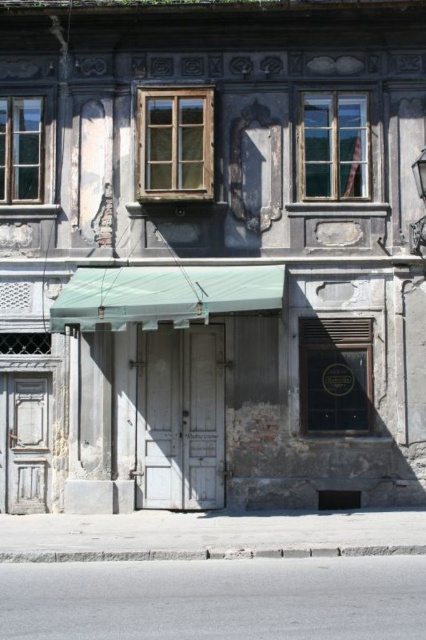
Question: Can you confirm if green fabric awning at center is positioned to the right of gray concrete curb at lower center?

Choices:
 (A) no
 (B) yes

Answer: (A)

Question: Is green fabric awning at center wider than gray concrete curb at lower center?

Choices:
 (A) yes
 (B) no

Answer: (B)

Question: Which point is closer to the camera taking this photo?

Choices:
 (A) (131, 321)
 (B) (106, 552)

Answer: (B)

Question: Can you confirm if green fabric awning at center is thinner than gray concrete curb at lower center?

Choices:
 (A) no
 (B) yes

Answer: (B)

Question: Which point is closer to the camera?

Choices:
 (A) (419, 550)
 (B) (60, 332)

Answer: (A)

Question: Which object appears farthest from the camera in this image?

Choices:
 (A) green fabric awning at center
 (B) gray concrete curb at lower center

Answer: (A)